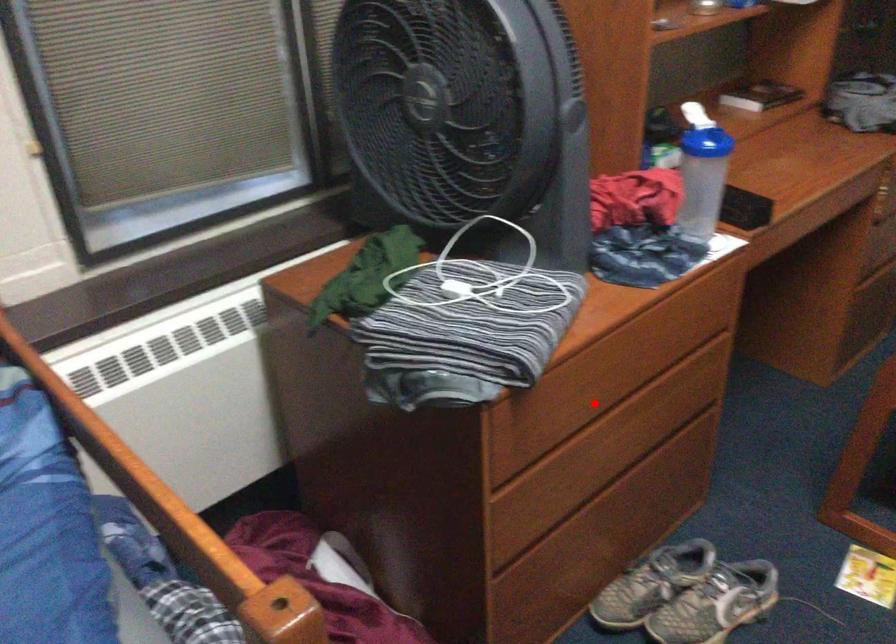
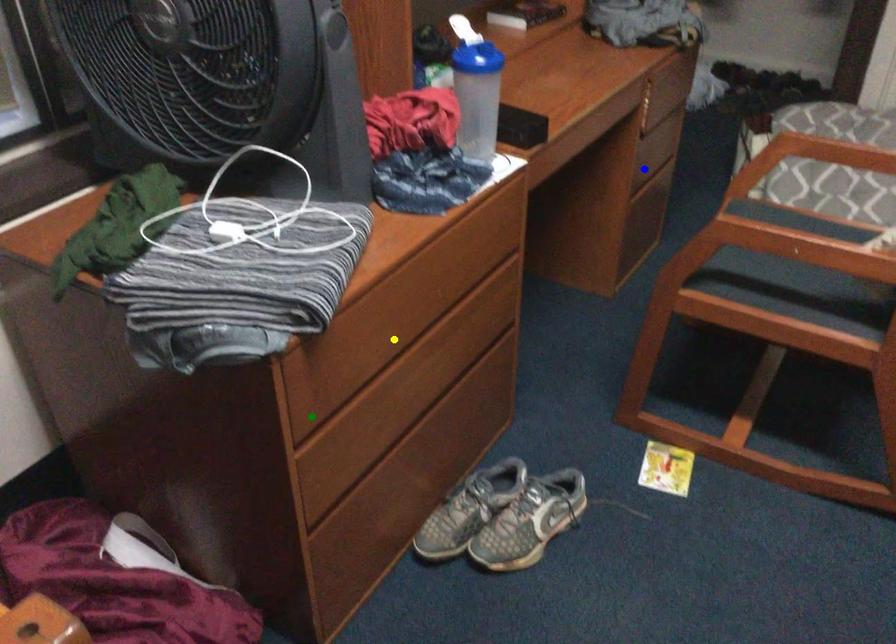
Question: I am providing you with two images of the same scene from different viewpoints. A red point is marked on the first image. You are given multiple points on the second image. Which point in image 2 is actually the same real-world point as the red point in image 1?

Choices:
 (A) blue point
 (B) green point
 (C) yellow point

Answer: (C)